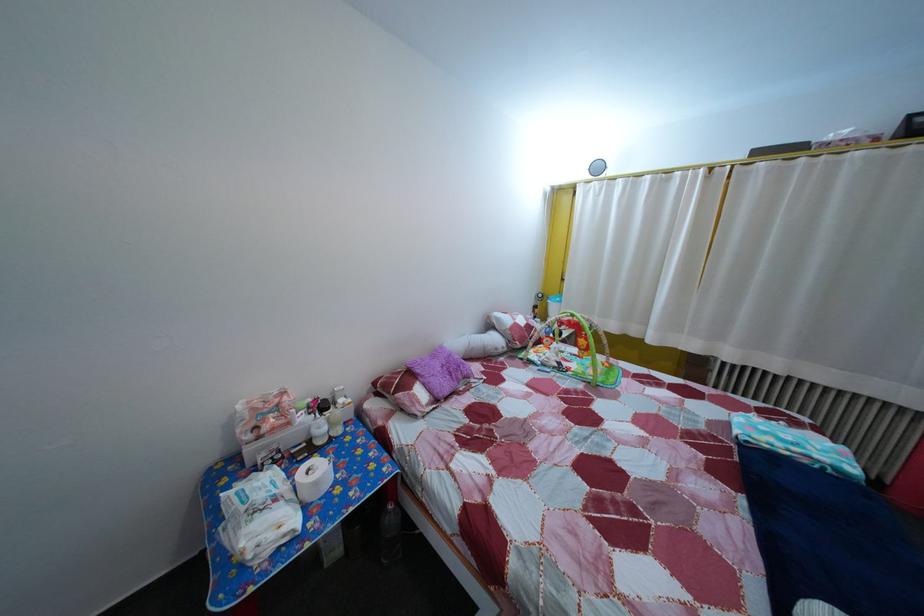
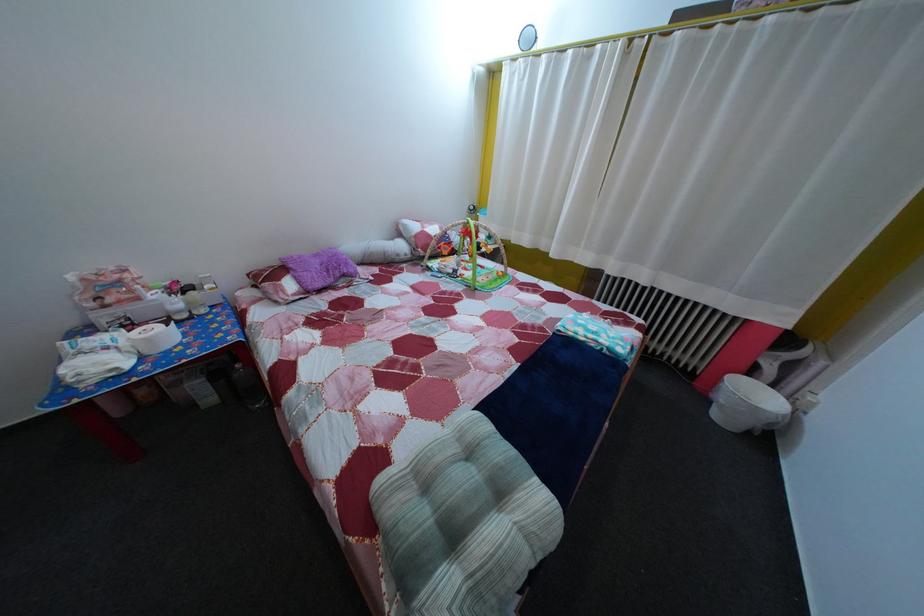
The point at [565,371] is marked in the first image. Where is the corresponding point in the second image?

(459, 278)